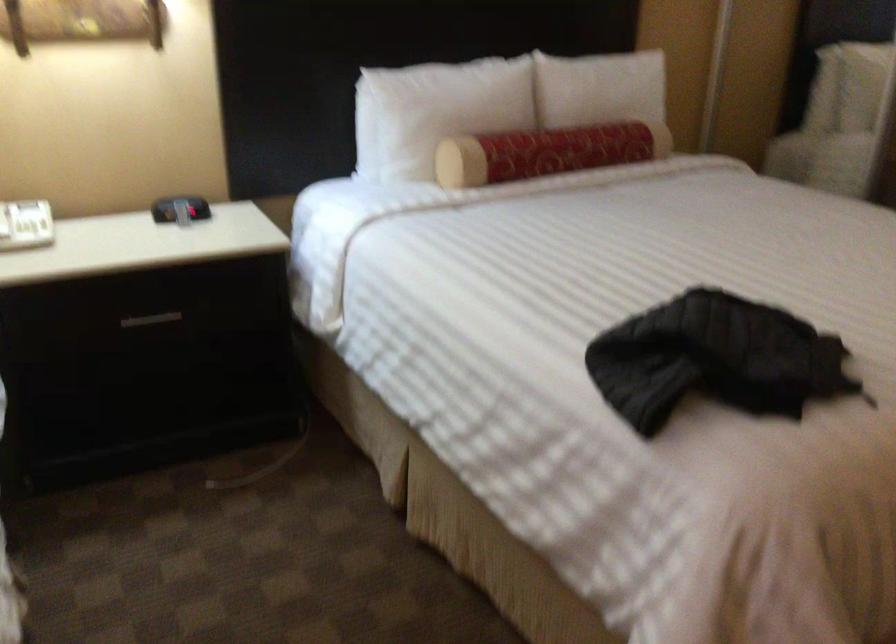
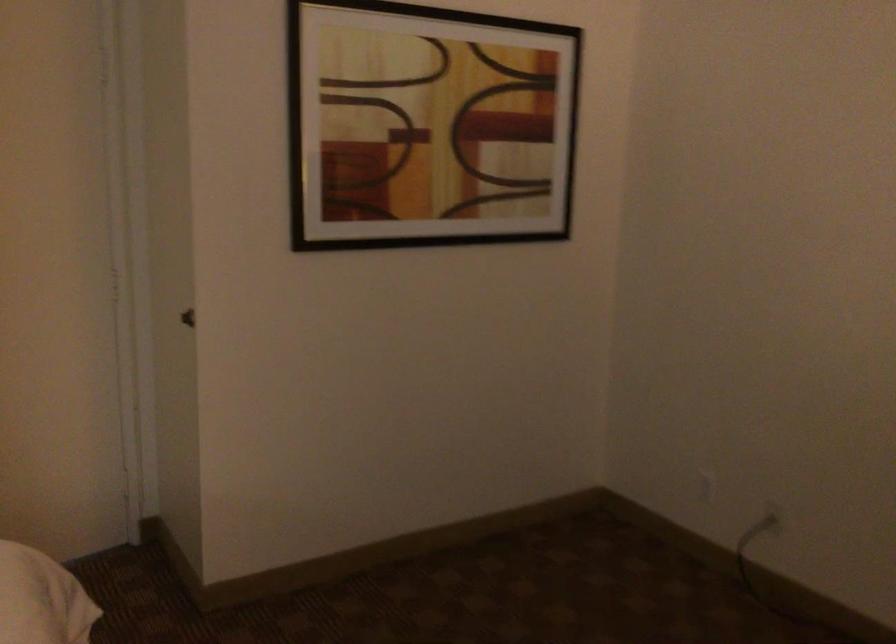
Question: How did the camera likely rotate?

Choices:
 (A) Left
 (B) Right
 (C) Up
 (D) Down

Answer: (B)